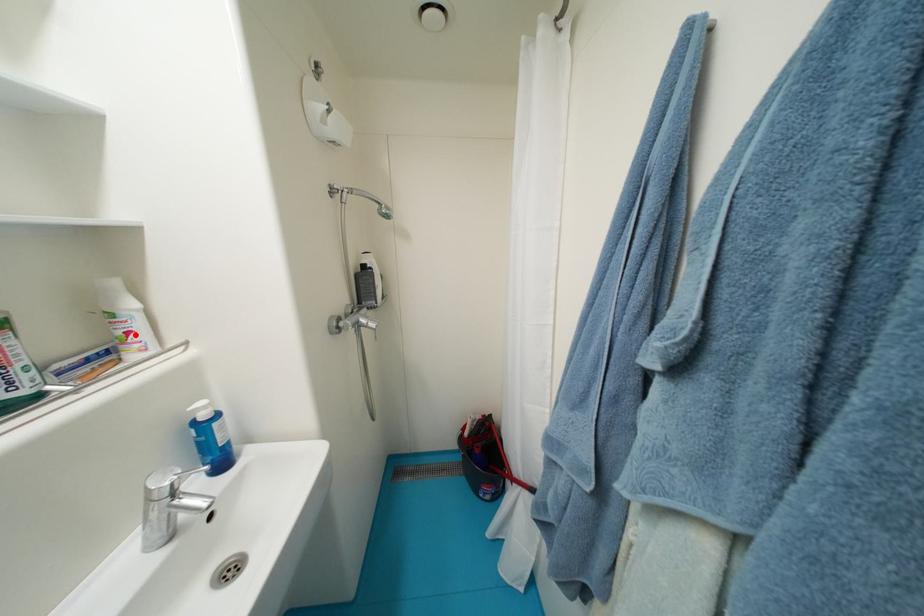
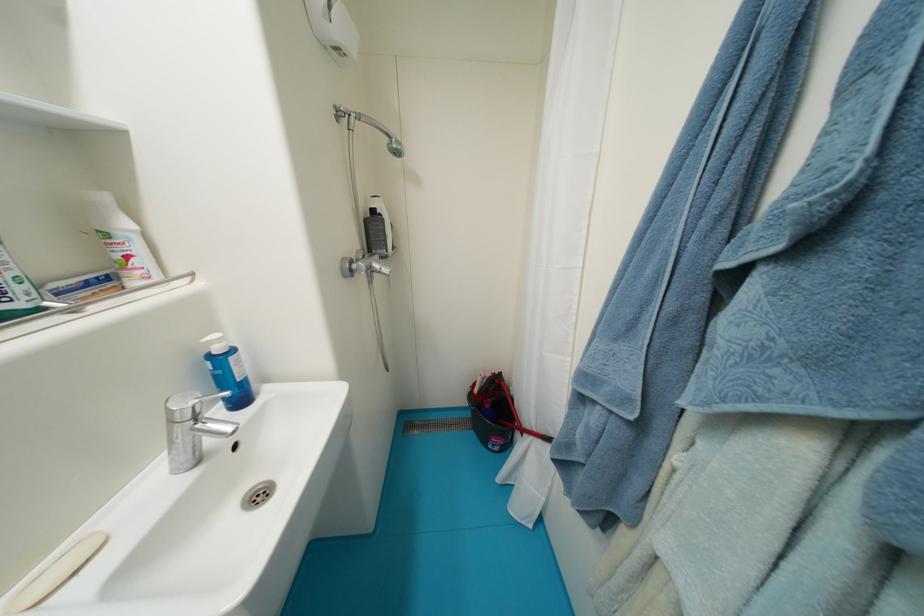
Find the pixel in the second image that matches the highlighted location in the first image.

(134, 259)